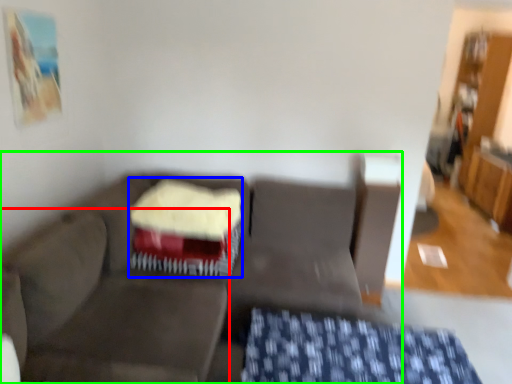
Question: Considering the real-world distances, which object is farthest from swivel chair (highlighted by a red box)? cake (highlighted by a blue box) or studio couch (highlighted by a green box)?

Choices:
 (A) cake
 (B) studio couch

Answer: (A)